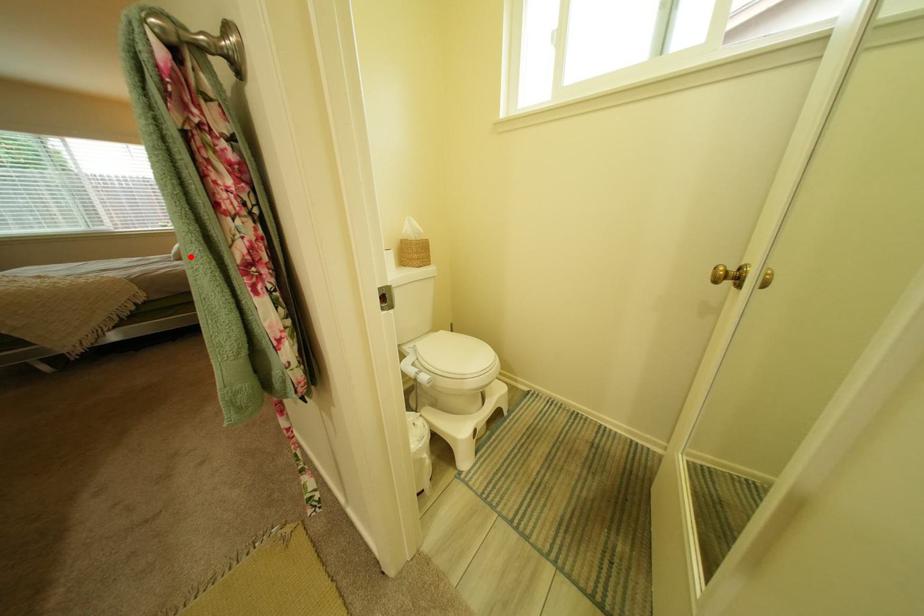
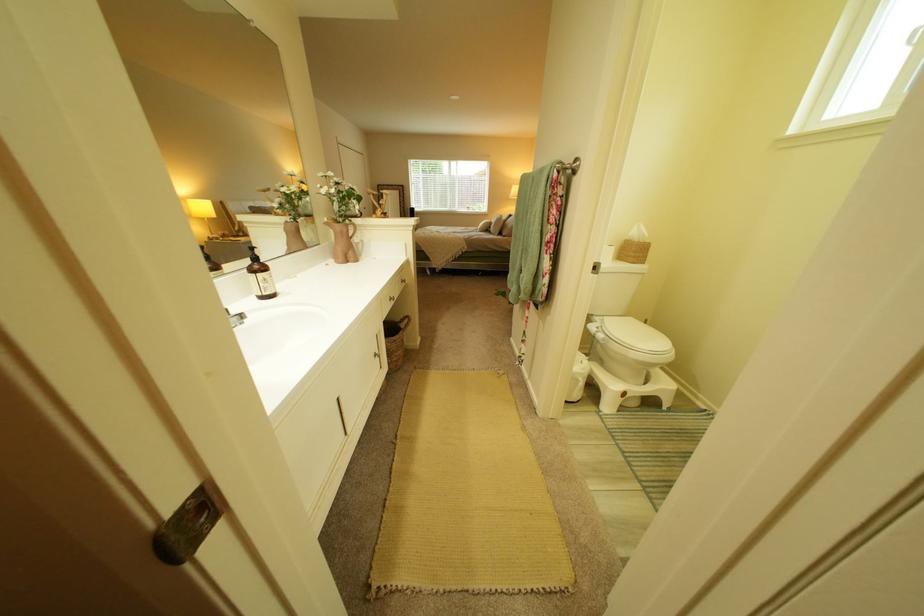
Question: I am providing you with two images of the same scene from different viewpoints. Image1 has a red point marked. In image2, the corresponding 3D location appears at what relative position? Reply with the corresponding letter.

Choices:
 (A) Closer
 (B) Farther

Answer: (A)